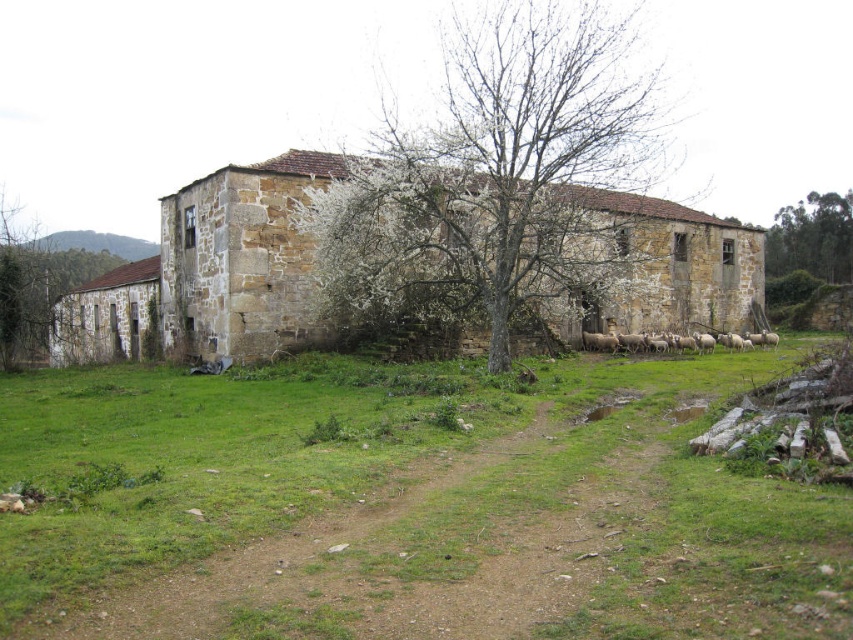
Question: Considering the real-world distances, which object is closest to the bare wood tree at center?

Choices:
 (A) green grass at center
 (B) bare branches at center
 (C) green leafy tree at upper right

Answer: (A)

Question: Which point is closer to the camera?

Choices:
 (A) (514, 54)
 (B) (99, 266)
 (C) (451, 362)
 (D) (831, 280)

Answer: (C)

Question: Which point is farther to the camera?

Choices:
 (A) bare branches at center
 (B) green grass at center

Answer: (A)

Question: From the image, what is the correct spatial relationship of bare wood tree at center in relation to green leafy tree at upper right?

Choices:
 (A) left
 (B) right

Answer: (A)

Question: Does bare branches at center have a lesser width compared to green leafy tree at upper right?

Choices:
 (A) yes
 (B) no

Answer: (A)

Question: Is bare branches at center thinner than bare wood tree at center?

Choices:
 (A) no
 (B) yes

Answer: (B)